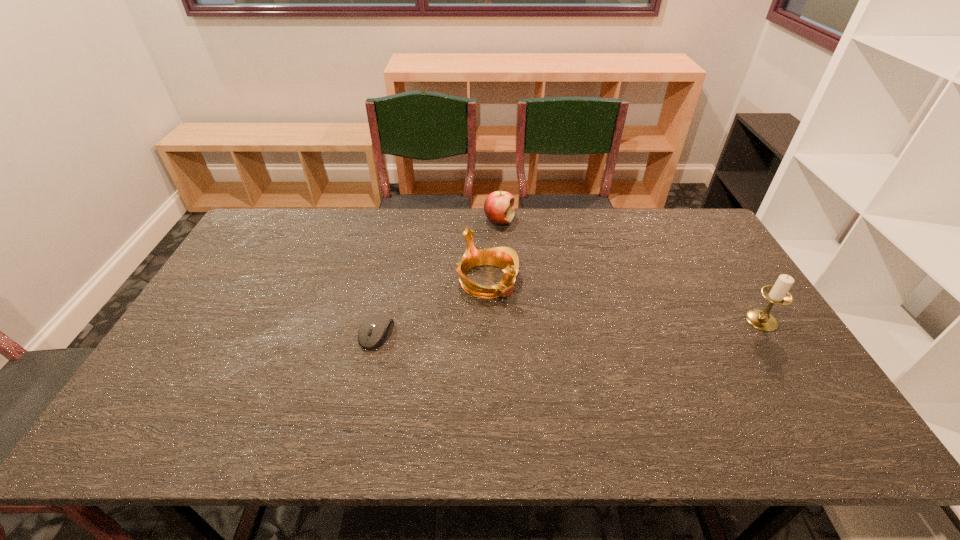
The height and width of the screenshot is (540, 960). Identify the location of vacant spot on the desktop that is between the computer equipment and the candle holder and is positioned on the bitten side of the apple. (573, 327).

You are a GUI agent. You are given a task and a screenshot of the screen. Output one action in this format:
    pyautogui.click(x=<x>, y=<y>)
    Task: Click on the free space on the desktop that is between the leftmost object and the rightmost object and is positioned at the front emblem of the second farthest object
    This screenshot has width=960, height=540.
    Given the screenshot: What is the action you would take?
    pyautogui.click(x=536, y=328)